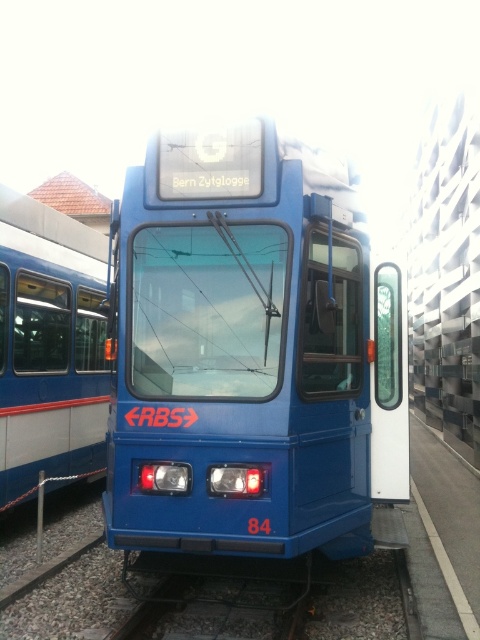
Question: Can you confirm if blue matte train at center is positioned to the right of blue painted metal passenger train at left?

Choices:
 (A) no
 (B) yes

Answer: (B)

Question: Which of the following is the closest to the observer?

Choices:
 (A) blue matte train at center
 (B) blue painted metal passenger train at left

Answer: (A)

Question: Which of the following is the farthest from the observer?

Choices:
 (A) blue matte train at center
 (B) blue painted metal passenger train at left

Answer: (B)

Question: Can you confirm if blue matte train at center is positioned to the right of blue painted metal passenger train at left?

Choices:
 (A) yes
 (B) no

Answer: (A)

Question: Is blue matte train at center in front of blue painted metal passenger train at left?

Choices:
 (A) no
 (B) yes

Answer: (B)